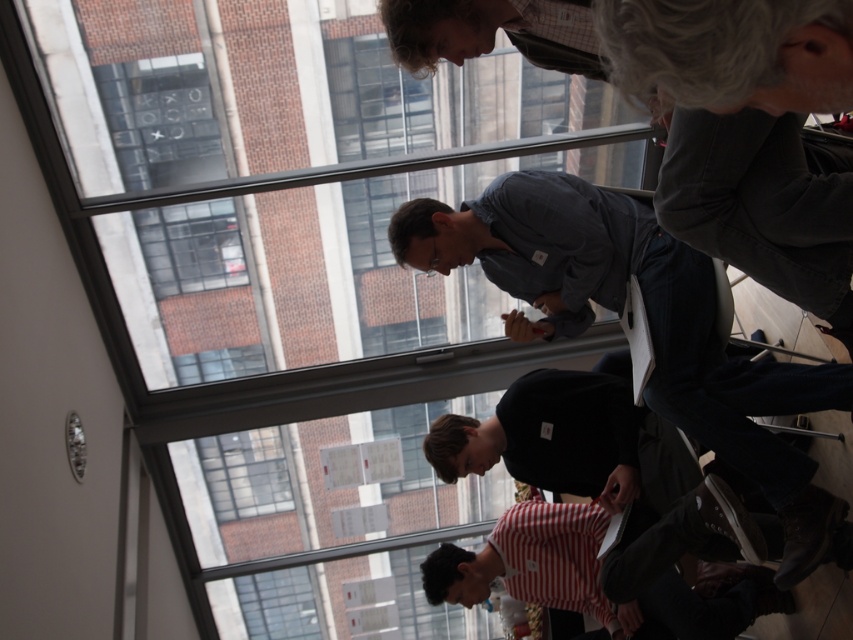
Can you confirm if denim shirt at center is positioned to the left of striped cotton shirt at lower center?

Indeed, denim shirt at center is positioned on the left side of striped cotton shirt at lower center.

Between denim shirt at center and striped cotton shirt at lower center, which one is positioned lower?

striped cotton shirt at lower center is below.

Is point (782, 458) farther from camera compared to point (619, 573)?

No.

Find the location of a particular element. denim shirt at center is located at coordinates (648, 324).